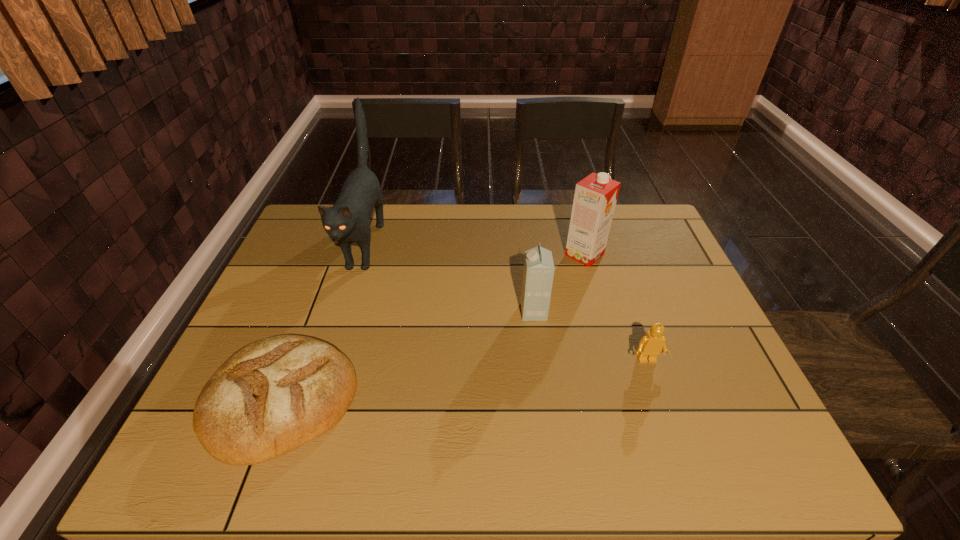
The height and width of the screenshot is (540, 960). I want to click on blank region between the bread and the second shortest object, so click(465, 381).

Identify the location of free spot between the bread and the tallest object. This screenshot has width=960, height=540. click(324, 322).

This screenshot has width=960, height=540. What are the coordinates of `vacant area that lies between the fourth tallest object and the third shortest object` in the screenshot? It's located at (590, 336).

This screenshot has width=960, height=540. Identify the location of free area in between the tallest object and the second shortest object. (506, 302).

This screenshot has height=540, width=960. In order to click on unoccupied area between the shortest object and the tallest object in this screenshot , I will do `click(324, 322)`.

Locate an element on the screen. This screenshot has height=540, width=960. free space between the shortest object and the shorter carton is located at coordinates (407, 356).

Where is `the closest object relative to the right carton`? This screenshot has width=960, height=540. the closest object relative to the right carton is located at coordinates (538, 272).

Select which object is the second closest to the left carton. Please provide its 2D coordinates. Your answer should be formatted as a tuple, i.e. [(x, y)], where the tuple contains the x and y coordinates of a point satisfying the conditions above.

[(650, 346)]

Where is `free space that satisfies the following two spatial constraints: 1. on the front label of the shorter carton; 2. on the front side of the bread`? free space that satisfies the following two spatial constraints: 1. on the front label of the shorter carton; 2. on the front side of the bread is located at coordinates (544, 400).

Where is `vacant position in the image that satisfies the following two spatial constraints: 1. on the back side of the shortest object; 2. on the left side of the taller carton`? vacant position in the image that satisfies the following two spatial constraints: 1. on the back side of the shortest object; 2. on the left side of the taller carton is located at coordinates (337, 254).